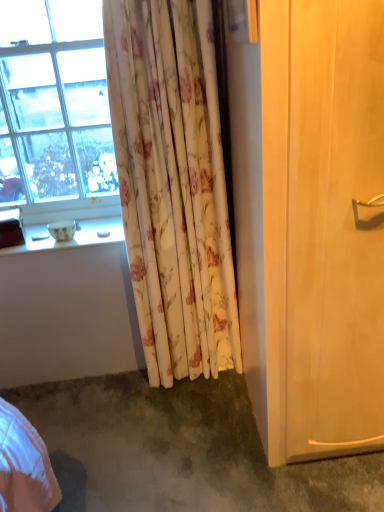
Measure the distance between point (77, 239) and camera.

A distance of 5.89 feet exists between point (77, 239) and camera.

Consider the image. What is the approximate width of white glossy window sill at lower left?

white glossy window sill at lower left is 12.95 inches in width.

What do you see at coordinates (58, 106) in the screenshot? The width and height of the screenshot is (384, 512). I see `transparent glass window at upper left` at bounding box center [58, 106].

Image resolution: width=384 pixels, height=512 pixels. What do you see at coordinates (322, 225) in the screenshot?
I see `light wood screen door at right` at bounding box center [322, 225].

What do you see at coordinates (62, 230) in the screenshot?
I see `white glossy bowl at lower left` at bounding box center [62, 230].

You are a GUI agent. You are given a task and a screenshot of the screen. Output one action in this format:
    pyautogui.click(x=<x>, y=<y>)
    Task: Click on the white glossy window sill at lower left
    
    Given the screenshot: What is the action you would take?
    pyautogui.click(x=70, y=240)

From a real-world perspective, is white glossy window sill at lower left on floral fabric curtain at center?

No, from a real-world perspective, white glossy window sill at lower left is not over floral fabric curtain at center

Is white glossy window sill at lower left completely or partially outside of floral fabric curtain at center?

white glossy window sill at lower left is positioned outside floral fabric curtain at center.

Considering the sizes of objects white glossy window sill at lower left and floral fabric curtain at center in the image provided, who is wider, white glossy window sill at lower left or floral fabric curtain at center?

Wider between the two is white glossy window sill at lower left.

Which is behind, point (179, 474) or point (74, 138)?

The point (74, 138) is farther.

Looking at their sizes, would you say gray carpet at lower left is wider or thinner than transparent glass window at upper left?

Considering their sizes, gray carpet at lower left looks broader than transparent glass window at upper left.

Can you confirm if gray carpet at lower left is taller than transparent glass window at upper left?

In fact, gray carpet at lower left may be shorter than transparent glass window at upper left.

What are the coordinates of `window above the gray carpet at lower left (from a real-world perspective)` in the screenshot? It's located at (58, 106).

Does white glossy bowl at lower left come behind white glossy window sill at lower left?

Yes, the depth of white glossy bowl at lower left is greater than that of white glossy window sill at lower left.

Is white glossy bowl at lower left facing towards white glossy window sill at lower left?

No, white glossy bowl at lower left does not turn towards white glossy window sill at lower left.

Considering the sizes of objects white glossy bowl at lower left and white glossy window sill at lower left in the image provided, who is taller, white glossy bowl at lower left or white glossy window sill at lower left?

With more height is white glossy bowl at lower left.

Where is `bowl that appears on the right of white glossy window sill at lower left`? bowl that appears on the right of white glossy window sill at lower left is located at coordinates (62, 230).

Is white glossy bowl at lower left positioned beyond the bounds of floral fabric curtain at center?

Yes.

From the image's perspective, is white glossy bowl at lower left on floral fabric curtain at center?

No.

From a real-world perspective, is white glossy bowl at lower left below floral fabric curtain at center?

Yes, from a real-world perspective, white glossy bowl at lower left is under floral fabric curtain at center.

Is white glossy bowl at lower left thinner than gray carpet at lower left?

Yes.

Is gray carpet at lower left at the back of white glossy bowl at lower left?

That's not correct — white glossy bowl at lower left is not looking away from gray carpet at lower left.

How many degrees apart are the facing directions of white glossy bowl at lower left and gray carpet at lower left?

88.4 degrees separate the facing orientations of white glossy bowl at lower left and gray carpet at lower left.

Does white glossy bowl at lower left have a larger size compared to gray carpet at lower left?

Actually, white glossy bowl at lower left might be smaller than gray carpet at lower left.

Can you confirm if gray carpet at lower left is taller than white glossy bowl at lower left?

In fact, gray carpet at lower left may be shorter than white glossy bowl at lower left.

Can you tell me how much gray carpet at lower left and white glossy bowl at lower left differ in facing direction?

The facing directions of gray carpet at lower left and white glossy bowl at lower left are 88.4 degrees apart.

Considering the relative sizes of gray carpet at lower left and white glossy bowl at lower left in the image provided, is gray carpet at lower left wider than white glossy bowl at lower left?

Indeed, gray carpet at lower left has a greater width compared to white glossy bowl at lower left.

Could white glossy bowl at lower left be considered to be inside gray carpet at lower left?

No, white glossy bowl at lower left is not a part of gray carpet at lower left.

Where is `concrete that is under the transparent glass window at upper left (from a real-world perspective)`? This screenshot has height=512, width=384. concrete that is under the transparent glass window at upper left (from a real-world perspective) is located at coordinates (180, 450).

How different are the orientations of transparent glass window at upper left and gray carpet at lower left in degrees?

The facing directions of transparent glass window at upper left and gray carpet at lower left are 90 degrees apart.

In terms of width, does transparent glass window at upper left look wider or thinner when compared to gray carpet at lower left?

Considering their sizes, transparent glass window at upper left looks slimmer than gray carpet at lower left.

I want to click on window sill below the floral fabric curtain at center (from a real-world perspective), so click(70, 240).

I want to click on window lying on the left of gray carpet at lower left, so click(58, 106).

Based on their spatial positions, is gray carpet at lower left or light wood screen door at right further from white glossy window sill at lower left?

Based on the image, light wood screen door at right appears to be further to white glossy window sill at lower left.

Looking at the image, which one is located closer to white glossy bowl at lower left, light wood screen door at right or transparent glass window at upper left?

transparent glass window at upper left lies closer to white glossy bowl at lower left than the other object.

Based on the photo, estimate the real-world distances between objects in this image. Which object is closer to white glossy window sill at lower left, light wood screen door at right or gray carpet at lower left?

gray carpet at lower left is positioned closer to the anchor white glossy window sill at lower left.

In the scene shown: Which object lies nearer to the anchor point light wood screen door at right, white glossy bowl at lower left or transparent glass window at upper left?

transparent glass window at upper left is closer to light wood screen door at right.

When comparing their distances from transparent glass window at upper left, does white glossy window sill at lower left or gray carpet at lower left seem further?

gray carpet at lower left.

Considering their positions, is white glossy bowl at lower left positioned further to gray carpet at lower left than transparent glass window at upper left?

transparent glass window at upper left is further to gray carpet at lower left.

Which object lies further to the anchor point gray carpet at lower left, transparent glass window at upper left or white glossy bowl at lower left?

Among the two, transparent glass window at upper left is located further to gray carpet at lower left.

Looking at the image, which one is located further to light wood screen door at right, white glossy window sill at lower left or floral fabric curtain at center?

white glossy window sill at lower left.

This screenshot has height=512, width=384. Identify the location of window sill between transparent glass window at upper left and light wood screen door at right. (70, 240).

At what (x,y) coordinates should I click in order to perform the action: click on concrete between white glossy bowl at lower left and light wood screen door at right from left to right. Please return your answer as a coordinate pair (x, y). Looking at the image, I should click on (180, 450).

Where is `screen door between floral fabric curtain at center and gray carpet at lower left in the vertical direction`? Image resolution: width=384 pixels, height=512 pixels. screen door between floral fabric curtain at center and gray carpet at lower left in the vertical direction is located at coordinates pos(322,225).

Where is `bowl between floral fabric curtain at center and gray carpet at lower left in the up-down direction`? This screenshot has width=384, height=512. bowl between floral fabric curtain at center and gray carpet at lower left in the up-down direction is located at coordinates (62, 230).